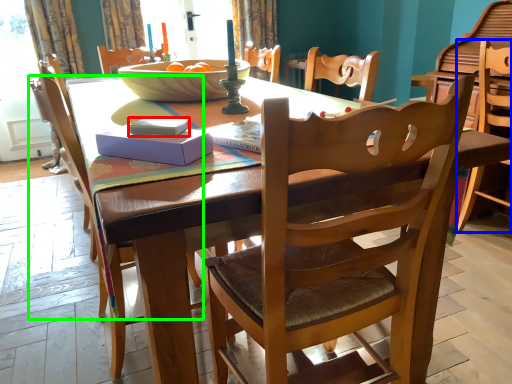
Question: Based on their relative distances, which object is farther from book (highlighted by a red box)? Choose from chair (highlighted by a blue box) and chair (highlighted by a green box).

Choices:
 (A) chair
 (B) chair

Answer: (A)